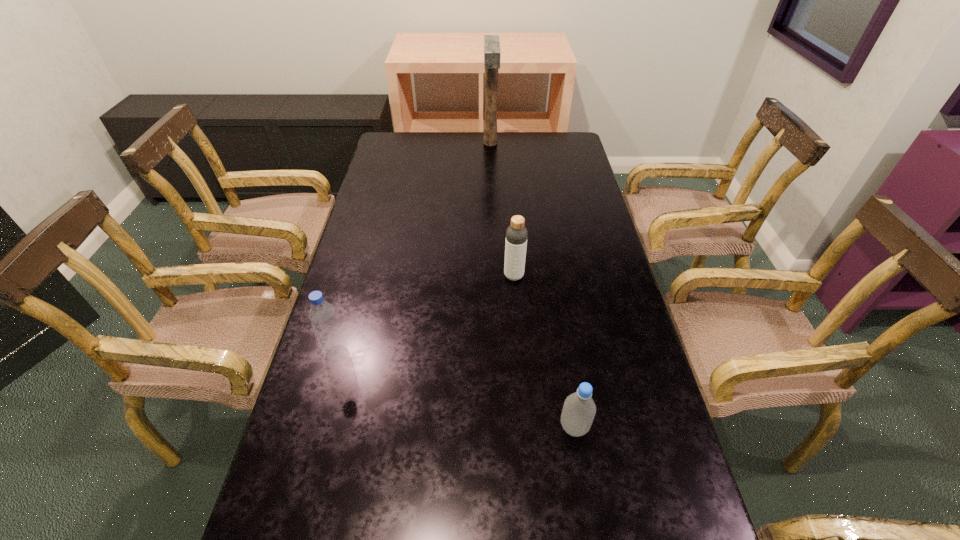
I want to click on unoccupied area between the tallest object and the leftmost bottle, so click(x=414, y=248).

Find the location of a particular element. This screenshot has width=960, height=540. free space between the nearest bottle and the leftmost bottle is located at coordinates [455, 389].

I want to click on vacant space in between the second bottle from right to left and the leftmost object, so click(x=425, y=314).

I want to click on unoccupied area between the third farthest object and the nearest bottle, so click(455, 389).

Find the location of a particular element. The width and height of the screenshot is (960, 540). free spot between the tallest object and the shortest bottle is located at coordinates (532, 285).

You are a GUI agent. You are given a task and a screenshot of the screen. Output one action in this format:
    pyautogui.click(x=<x>, y=<y>)
    Task: Click on the free space that is in between the shortest bottle and the farthest object
    
    Given the screenshot: What is the action you would take?
    pyautogui.click(x=532, y=285)

Locate an element on the screen. vacant area that lies between the nearest bottle and the mallet is located at coordinates (532, 285).

This screenshot has width=960, height=540. In order to click on free spot between the farthest bottle and the leftmost object in this screenshot , I will do `click(425, 314)`.

Locate an element on the screen. This screenshot has width=960, height=540. object that is the second nearest to the farthest bottle is located at coordinates (322, 315).

You are a GUI agent. You are given a task and a screenshot of the screen. Output one action in this format:
    pyautogui.click(x=<x>, y=<y>)
    Task: Click on the object that stands as the third closest to the third nearest object
    The height and width of the screenshot is (540, 960).
    Given the screenshot: What is the action you would take?
    pyautogui.click(x=492, y=54)